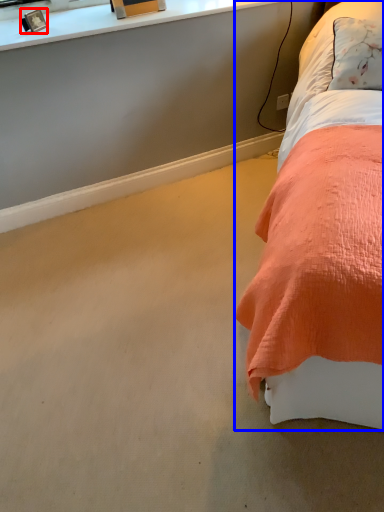
Question: Which object is closer to the camera taking this photo, picture frame (highlighted by a red box) or bed (highlighted by a blue box)?

Choices:
 (A) picture frame
 (B) bed

Answer: (B)